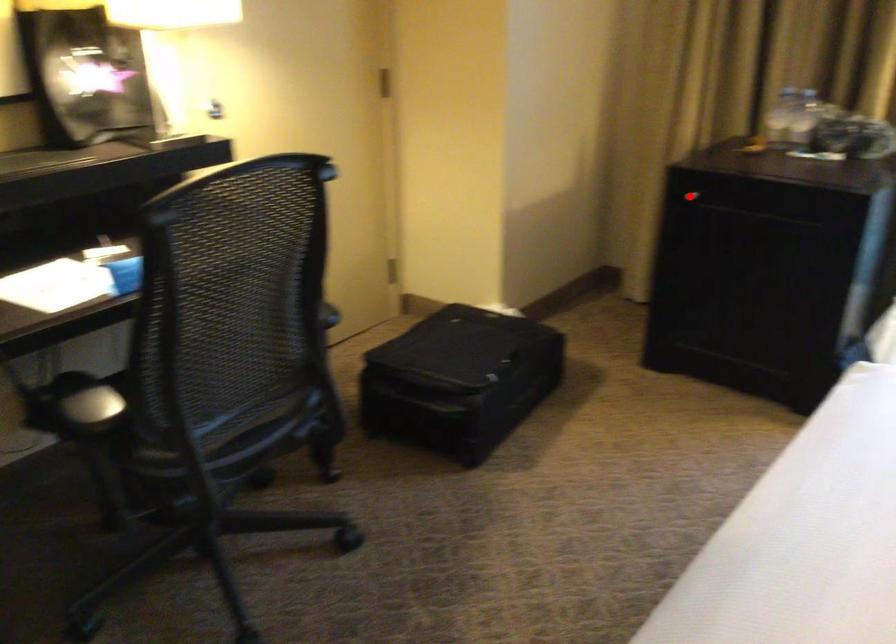
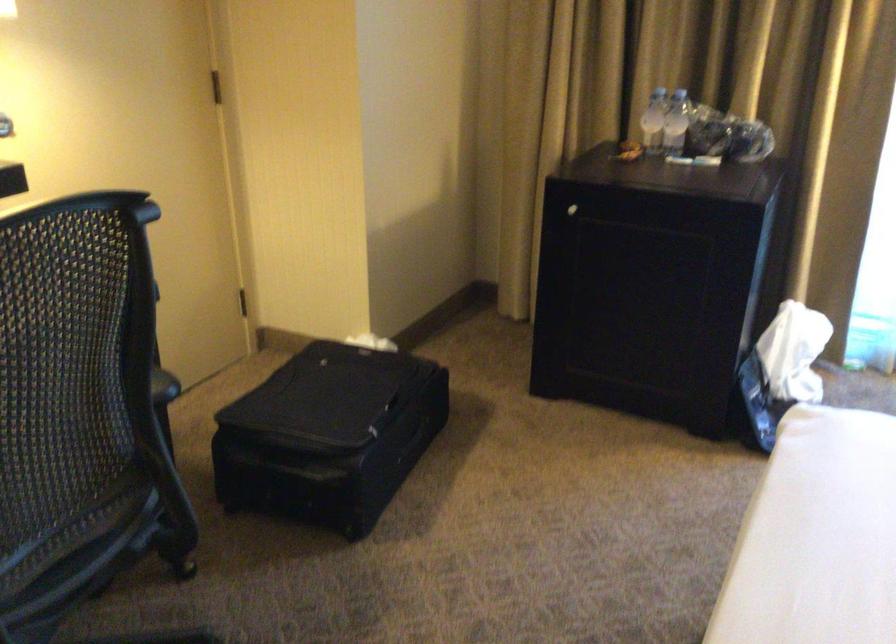
Locate, in the second image, the point that corresponds to the highlighted location in the first image.

(572, 210)